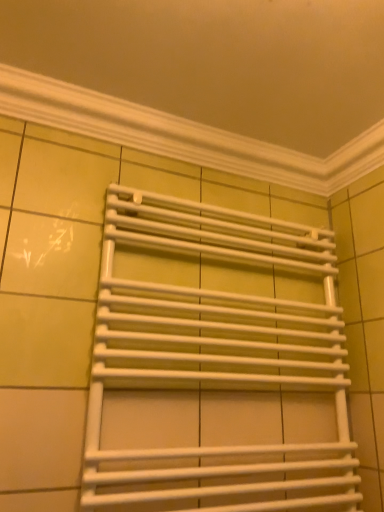
The width and height of the screenshot is (384, 512). What do you see at coordinates (183, 135) in the screenshot? I see `white plastic towel rack at upper center` at bounding box center [183, 135].

Locate an element on the screen. This screenshot has height=512, width=384. white plastic towel rack at upper center is located at coordinates (183, 135).

This screenshot has height=512, width=384. Describe the element at coordinates (216, 364) in the screenshot. I see `white matte towel rack at center` at that location.

Where is `white matte towel rack at center`? white matte towel rack at center is located at coordinates (216, 364).

What is the approximate width of white matte towel rack at center?

It is 6.22 inches.

At what (x,y) coordinates should I click in order to perform the action: click on white plastic towel rack at upper center. Please return your answer as a coordinate pair (x, y). This screenshot has width=384, height=512. Looking at the image, I should click on (183, 135).

Looking at this image, can you confirm if white plastic towel rack at upper center is positioned to the right of white matte towel rack at center?

In fact, white plastic towel rack at upper center is to the left of white matte towel rack at center.

In the scene shown: Which object is closer to the camera, white plastic towel rack at upper center or white matte towel rack at center?

white matte towel rack at center is closer to the camera.

Is point (33, 92) closer to viewer compared to point (291, 485)?

Yes, point (33, 92) is closer to viewer.

From the image's perspective, is white plastic towel rack at upper center under white matte towel rack at center?

Actually, white plastic towel rack at upper center appears above white matte towel rack at center in the image.

From a real-world perspective, does white plastic towel rack at upper center sit lower than white matte towel rack at center?

Incorrect, from a real-world perspective, white plastic towel rack at upper center is higher than white matte towel rack at center.

In terms of width, does white plastic towel rack at upper center look wider or thinner when compared to white matte towel rack at center?

Clearly, white plastic towel rack at upper center has less width compared to white matte towel rack at center.

Based on the photo, in terms of height, does white plastic towel rack at upper center look taller or shorter compared to white matte towel rack at center?

Considering their sizes, white plastic towel rack at upper center has less height than white matte towel rack at center.

Considering the sizes of objects white plastic towel rack at upper center and white matte towel rack at center in the image provided, who is bigger, white plastic towel rack at upper center or white matte towel rack at center?

With larger size is white matte towel rack at center.

Is white plastic towel rack at upper center positioned beyond the bounds of white matte towel rack at center?

Yes, white plastic towel rack at upper center is outside of white matte towel rack at center.

Is white plastic towel rack at upper center far away from white matte towel rack at center?

That's not correct — white plastic towel rack at upper center is a little close to white matte towel rack at center.

Is white plastic towel rack at upper center facing away from white matte towel rack at center?

No, white plastic towel rack at upper center is not facing away from white matte towel rack at center.

How different are the orientations of white plastic towel rack at upper center and white matte towel rack at center in degrees?

The angular difference between white plastic towel rack at upper center and white matte towel rack at center is 0.371 degrees.

I want to click on towel rack on the right of white plastic towel rack at upper center, so click(216, 364).

Which is more to the left, white matte towel rack at center or white plastic towel rack at upper center?

white plastic towel rack at upper center is more to the left.

Is white matte towel rack at center in front of or behind white plastic towel rack at upper center in the image?

Clearly, white matte towel rack at center is in front of white plastic towel rack at upper center.

Considering the positions of points (307, 348) and (51, 84), is point (307, 348) farther from camera compared to point (51, 84)?

Yes, it is behind point (51, 84).

From the picture: From the image's perspective, which is below, white matte towel rack at center or white plastic towel rack at upper center?

From the image's view, white matte towel rack at center is below.

From a real-world perspective, is white matte towel rack at center physically below white plastic towel rack at upper center?

Indeed, from a real-world perspective, white matte towel rack at center is positioned beneath white plastic towel rack at upper center.

Which object is wider, white matte towel rack at center or white plastic towel rack at upper center?

white matte towel rack at center is wider.

Considering the relative sizes of white matte towel rack at center and white plastic towel rack at upper center in the image provided, is white matte towel rack at center taller than white plastic towel rack at upper center?

Correct, white matte towel rack at center is much taller as white plastic towel rack at upper center.

Considering the relative sizes of white matte towel rack at center and white plastic towel rack at upper center in the image provided, is white matte towel rack at center smaller than white plastic towel rack at upper center?

Incorrect, white matte towel rack at center is not smaller in size than white plastic towel rack at upper center.

From the picture: Is white plastic towel rack at upper center surrounded by white matte towel rack at center?

No.

In the scene shown: Is the surface of white matte towel rack at center in direct contact with white plastic towel rack at upper center?

white matte towel rack at center and white plastic towel rack at upper center are clearly separated.

Could you tell me if white matte towel rack at center is turned towards white plastic towel rack at upper center?

No, white matte towel rack at center is not turned towards white plastic towel rack at upper center.

How different are the orientations of white matte towel rack at center and white plastic towel rack at upper center in degrees?

0.371 degrees separate the facing orientations of white matte towel rack at center and white plastic towel rack at upper center.

Where is `window frame above the white matte towel rack at center (from the image's perspective)`? The height and width of the screenshot is (512, 384). window frame above the white matte towel rack at center (from the image's perspective) is located at coordinates (183, 135).

The height and width of the screenshot is (512, 384). Identify the location of window frame behind the white matte towel rack at center. (183, 135).

Where is `window frame on the left of white matte towel rack at center`? The width and height of the screenshot is (384, 512). window frame on the left of white matte towel rack at center is located at coordinates (183, 135).